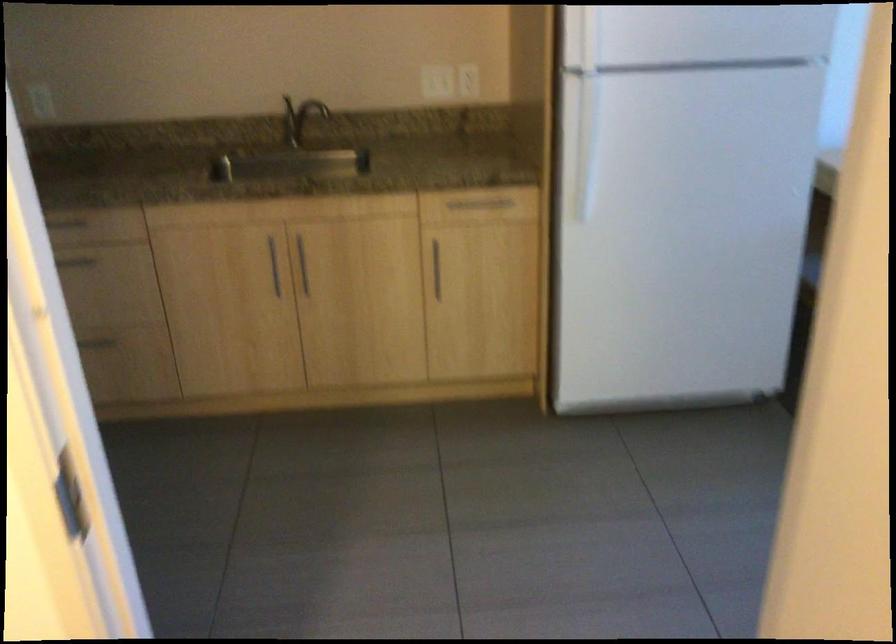
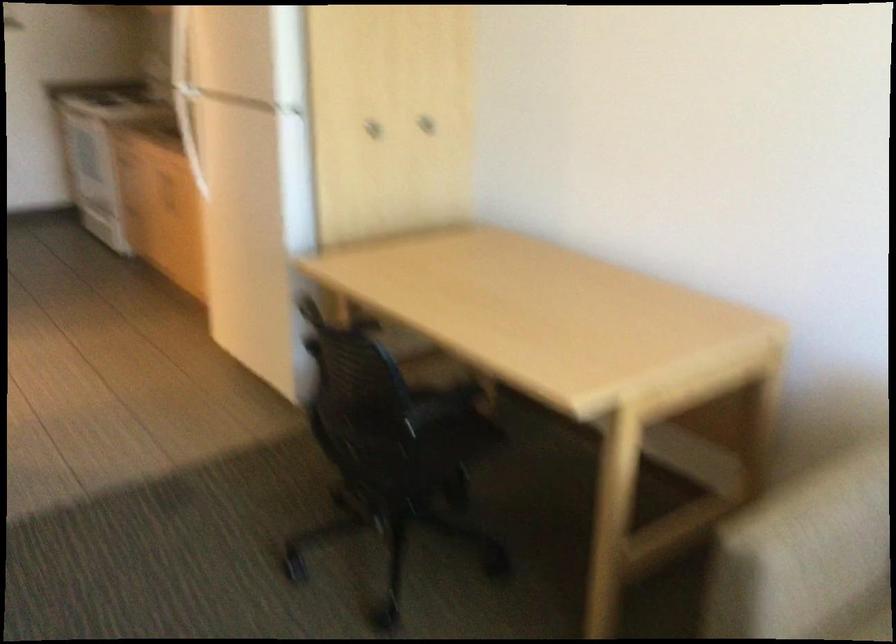
Question: I am providing you with two images of the same scene from different viewpoints. Please identify which objects are invisible in image2.

Choices:
 (A) refrigerator door handle
 (B) cabinet door knob
 (C) pink patterned skateboard
 (D) wall outlet

Answer: (D)